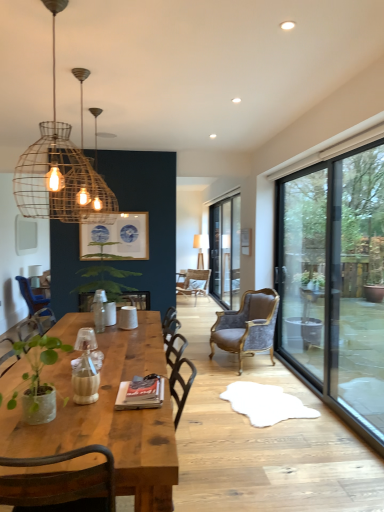
Question: Could transparent glass window at right be considered to be inside wooden table at center?

Choices:
 (A) yes
 (B) no

Answer: (B)

Question: Is wooden table at center to the right of transparent glass window at right from the viewer's perspective?

Choices:
 (A) no
 (B) yes

Answer: (A)

Question: From the image's perspective, is wooden table at center on top of transparent glass window at right?

Choices:
 (A) no
 (B) yes

Answer: (A)

Question: Does wooden table at center have a lesser height compared to transparent glass window at right?

Choices:
 (A) yes
 (B) no

Answer: (A)

Question: Are wooden table at center and transparent glass window at right beside each other?

Choices:
 (A) no
 (B) yes

Answer: (A)

Question: Is wooden table at center outside of transparent glass window at right?

Choices:
 (A) yes
 (B) no

Answer: (A)

Question: Does velvet brown armchair at center, the third chair positioned from the left, lie in front of transparent glass window at right?

Choices:
 (A) no
 (B) yes

Answer: (A)

Question: From a real-world perspective, is velvet brown armchair at center, the first chair from the front, over transparent glass window at right?

Choices:
 (A) no
 (B) yes

Answer: (A)

Question: Can you confirm if velvet brown armchair at center, the third chair positioned from the left, is thinner than transparent glass window at right?

Choices:
 (A) yes
 (B) no

Answer: (B)

Question: Is velvet brown armchair at center, the first chair from the front, oriented towards transparent glass window at right?

Choices:
 (A) yes
 (B) no

Answer: (B)

Question: Can we say velvet brown armchair at center, the first chair from the right, lies outside transparent glass window at right?

Choices:
 (A) no
 (B) yes

Answer: (B)

Question: Does velvet brown armchair at center, the first chair from the right, appear on the right side of transparent glass window at right?

Choices:
 (A) yes
 (B) no

Answer: (B)

Question: Can you confirm if rustic wire pendant light at upper left is taller than white matte cup at center?

Choices:
 (A) yes
 (B) no

Answer: (A)